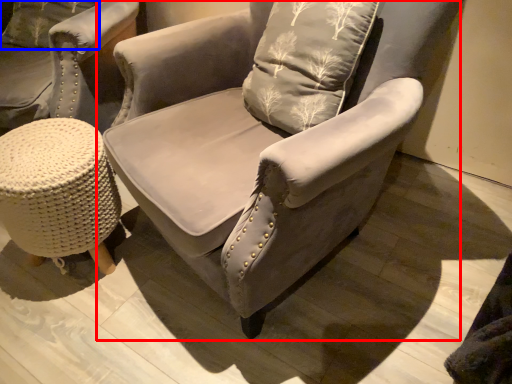
Question: Which of the following is the farthest to the observer, chair (highlighted by a red box) or pillow (highlighted by a blue box)?

Choices:
 (A) chair
 (B) pillow

Answer: (B)